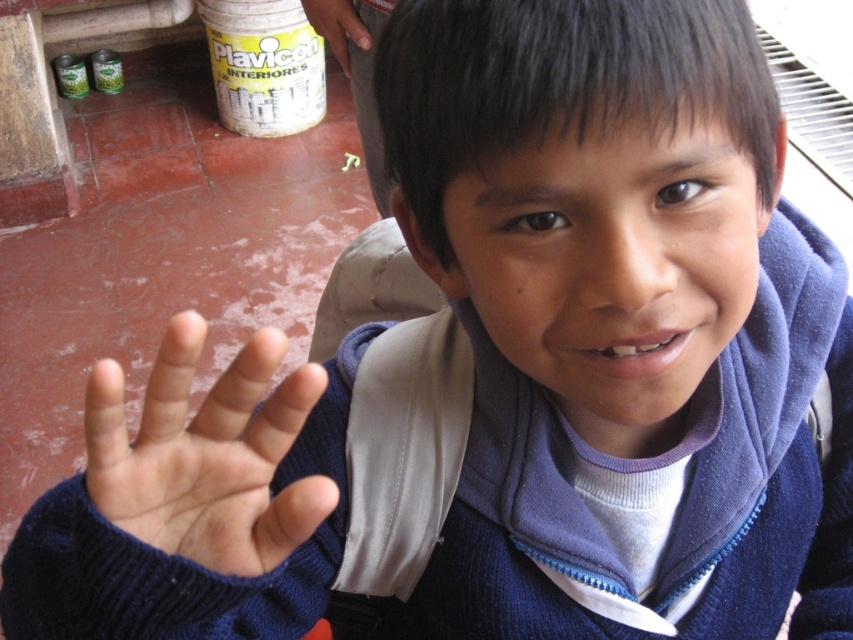
You are standing at the point labeled point (x=347, y=24) and want to walk to the point labeled point (x=180, y=355). According to the image, which direction should you move?

You should move forward because point (x=180, y=355) is in front of point (x=347, y=24).